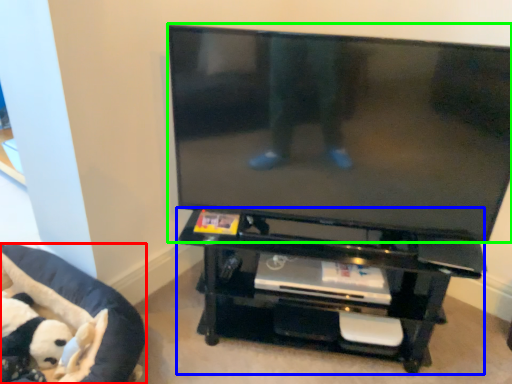
Question: Estimate the real-world distances between objects in this image. Which object is closer to furniture (highlighted by a red box), entertainment center (highlighted by a blue box) or television (highlighted by a green box)?

Choices:
 (A) entertainment center
 (B) television

Answer: (A)